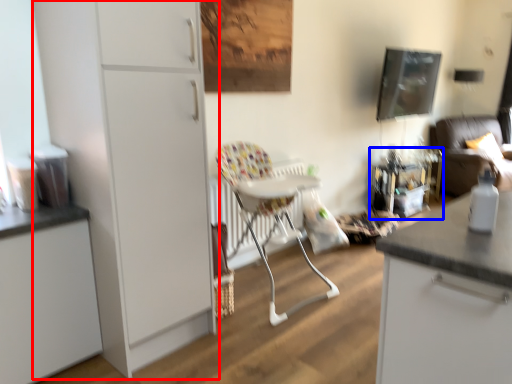
Question: Which object is closer to the camera taking this photo, cabinetry (highlighted by a red box) or table (highlighted by a blue box)?

Choices:
 (A) cabinetry
 (B) table

Answer: (A)